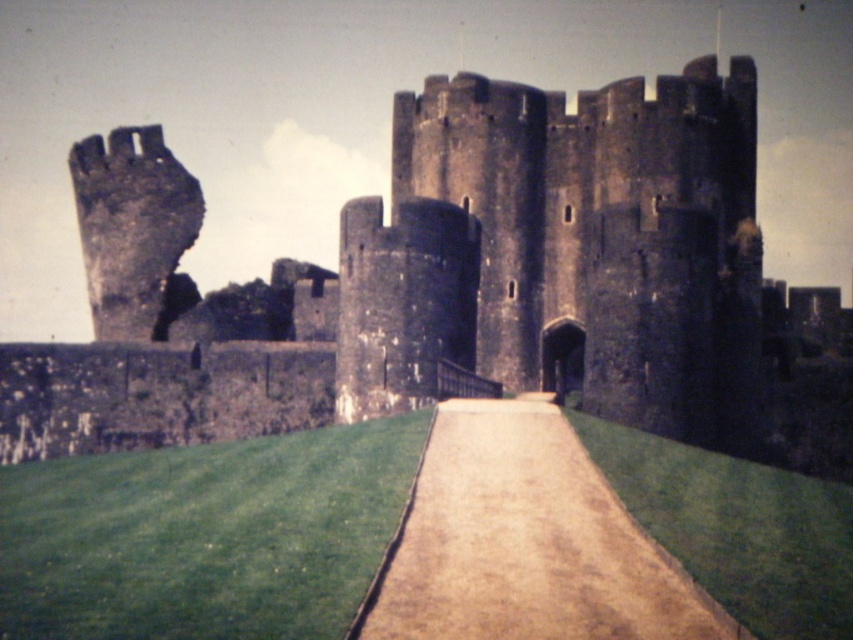
Question: Which point is closer to the camera?

Choices:
 (A) dark stone castle at center
 (B) green grass at lower left

Answer: (B)

Question: Which is farther from the dark stone castle at center?

Choices:
 (A) brown gravel path at center
 (B) green grass at lower left

Answer: (A)

Question: Estimate the real-world distances between objects in this image. Which object is farther from the green grass at lower left?

Choices:
 (A) brown gravel path at center
 (B) dark stone castle at center

Answer: (B)

Question: Is dark stone castle at center closer to the viewer compared to green grass at lower left?

Choices:
 (A) yes
 (B) no

Answer: (B)

Question: Is dark stone castle at center smaller than brown gravel path at center?

Choices:
 (A) no
 (B) yes

Answer: (A)

Question: Does dark stone castle at center appear over brown gravel path at center?

Choices:
 (A) yes
 (B) no

Answer: (A)